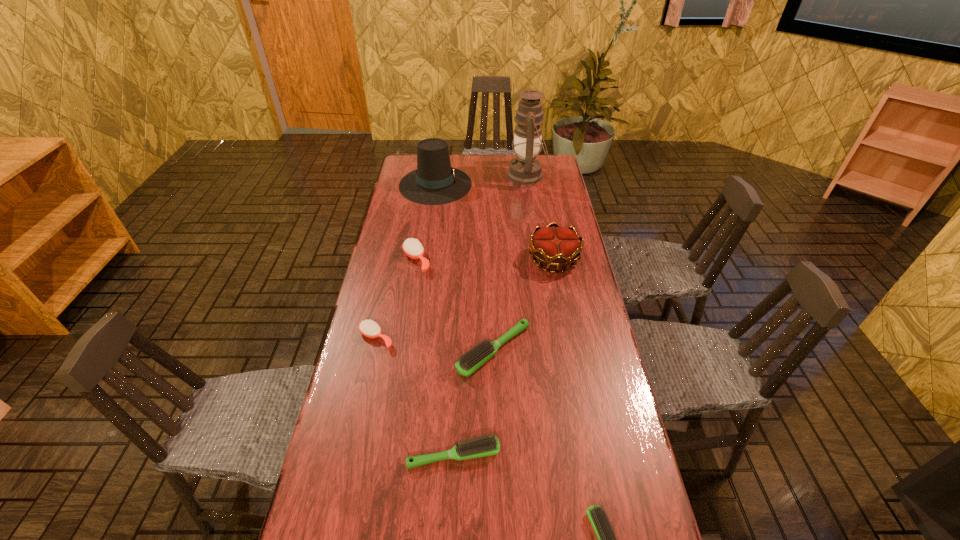
You are a GUI agent. You are given a task and a screenshot of the screen. Output one action in this format:
    pyautogui.click(x=<x>, y=<y>)
    Task: Click on the second nearest hairbrush
    
    Given the screenshot: What is the action you would take?
    pyautogui.click(x=485, y=446)

You are a GUI agent. You are given a task and a screenshot of the screen. Output one action in this format:
    pyautogui.click(x=<x>, y=<y>)
    Task: Click on the nearer orange hairbrush
    The width and height of the screenshot is (960, 540).
    Given the screenshot: What is the action you would take?
    pyautogui.click(x=369, y=328)

Where is `vacant region located 0.260m on the front of the brown oil lamp`? vacant region located 0.260m on the front of the brown oil lamp is located at coordinates (535, 226).

Where is `vacant point located on the front-facing side of the hat`? Image resolution: width=960 pixels, height=540 pixels. vacant point located on the front-facing side of the hat is located at coordinates (501, 184).

Identify the location of free space located on the back of the crown. (547, 222).

In order to click on vacant position located on the right of the farther orange hairbrush in this screenshot , I will do `click(507, 260)`.

This screenshot has width=960, height=540. What are the coordinates of `free point located on the front of the farthest light hairbrush` in the screenshot? It's located at (499, 526).

The width and height of the screenshot is (960, 540). In order to click on free space located 0.390m on the back of the second nearest object in this screenshot , I will do `click(460, 321)`.

Locate an element on the screen. This screenshot has width=960, height=540. blank space located on the right of the smaller orange hairbrush is located at coordinates (428, 338).

Locate an element on the screen. The image size is (960, 540). oil lamp at the far edge is located at coordinates (525, 169).